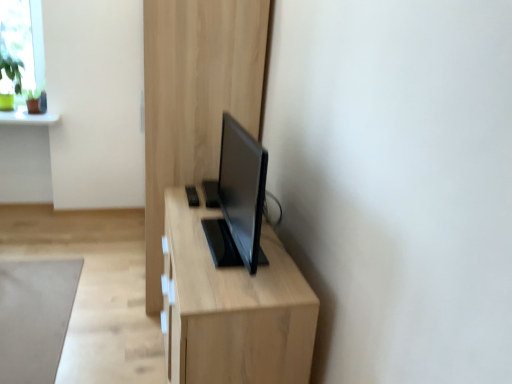
Describe the element at coordinates (195, 98) in the screenshot. I see `light wood dresser at center` at that location.

Image resolution: width=512 pixels, height=384 pixels. What do you see at coordinates (35, 317) in the screenshot?
I see `gray matte rug at lower left` at bounding box center [35, 317].

Where is `light wood table at center`? light wood table at center is located at coordinates (231, 307).

Considering the relative sizes of light wood table at center and gray matte rug at lower left in the image provided, is light wood table at center shorter than gray matte rug at lower left?

In fact, light wood table at center may be taller than gray matte rug at lower left.

From a real-world perspective, which object stands above the other?

From a 3D spatial view, light wood table at center is above.

In the scene shown: Is light wood table at center turned away from gray matte rug at lower left?

That's not correct — light wood table at center is not looking away from gray matte rug at lower left.

Is light wood table at center closer to camera compared to gray matte rug at lower left?

Yes, light wood table at center is in front of gray matte rug at lower left.

Is gray matte rug at lower left positioned behind light wood table at center?

Yes, gray matte rug at lower left is further from the viewer.

From the image's perspective, between gray matte rug at lower left and light wood table at center, which one is located above?

light wood table at center is shown above in the image.

Is gray matte rug at lower left not inside light wood table at center?

Indeed, gray matte rug at lower left is completely outside light wood table at center.

From the image's perspective, does light wood dresser at center appear lower than light wood table at center?

No, from the image's perspective, light wood dresser at center is not beneath light wood table at center.

Does point (259, 105) come closer to viewer compared to point (243, 319)?

No.

Is light wood dresser at center not near light wood table at center?

That's not correct — light wood dresser at center is a little close to light wood table at center.

Looking at this image, is light wood dresser at center surrounding light wood table at center?

Actually, light wood table at center is outside light wood dresser at center.

From a real-world perspective, is light wood table at center on top of light wood dresser at center?

No, from a real-world perspective, light wood table at center is not on top of light wood dresser at center.

Is light wood table at center far from light wood dresser at center?

No, light wood table at center is not far from light wood dresser at center.

Measure the distance from gray matte rug at lower left to light wood dresser at center.

gray matte rug at lower left and light wood dresser at center are 96.01 centimeters apart from each other.

Locate an element on the screen. The width and height of the screenshot is (512, 384). dresser above the gray matte rug at lower left (from a real-world perspective) is located at coordinates (195, 98).

Is gray matte rug at lower left shorter than light wood dresser at center?

Yes.

Is gray matte rug at lower left surrounding light wood dresser at center?

Actually, light wood dresser at center is outside gray matte rug at lower left.

Is gray matte rug at lower left located within light wood dresser at center?

Actually, gray matte rug at lower left is outside light wood dresser at center.

Is light wood dresser at center oriented away from gray matte rug at lower left?

light wood dresser at center is not turned away from gray matte rug at lower left.

Is the surface of light wood dresser at center in direct contact with gray matte rug at lower left?

No, light wood dresser at center is not making contact with gray matte rug at lower left.

This screenshot has width=512, height=384. Identify the location of plain to the left of light wood table at center. (35, 317).

Find the location of `plain located below the light wood table at center (from the image's perspective)`. plain located below the light wood table at center (from the image's perspective) is located at coordinates (35, 317).

Based on the photo, estimate the real-world distances between objects in this image. Which object is further from light wood table at center, gray matte rug at lower left or light wood dresser at center?

The object further to light wood table at center is gray matte rug at lower left.

Which object lies nearer to the anchor point light wood dresser at center, gray matte rug at lower left or light wood table at center?

The object closer to light wood dresser at center is light wood table at center.

When comparing their distances from gray matte rug at lower left, does light wood dresser at center or light wood table at center seem further?

light wood table at center is further to gray matte rug at lower left.

Looking at this image, from the image, which object appears to be nearer to gray matte rug at lower left, light wood table at center or light wood dresser at center?

Based on the image, light wood dresser at center appears to be nearer to gray matte rug at lower left.

Estimate the real-world distances between objects in this image. Which object is further from light wood table at center, light wood dresser at center or gray matte rug at lower left?

gray matte rug at lower left lies further to light wood table at center than the other object.

Looking at the image, which one is located further to light wood dresser at center, light wood table at center or gray matte rug at lower left?

gray matte rug at lower left.

The width and height of the screenshot is (512, 384). I want to click on dresser between gray matte rug at lower left and light wood table at center in the horizontal direction, so click(x=195, y=98).